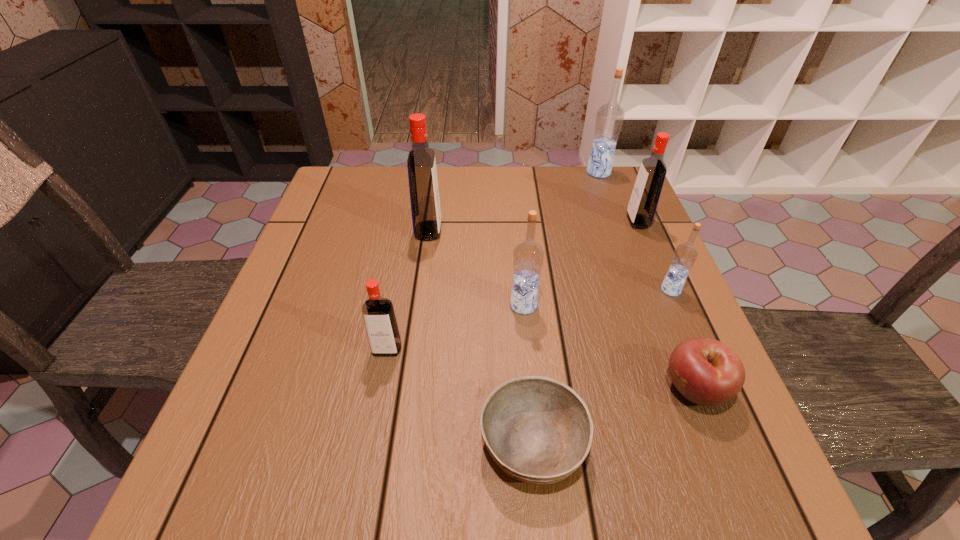
Identify the location of the farthest vodka. (609, 119).

I want to click on the farthest object, so click(x=609, y=119).

The height and width of the screenshot is (540, 960). What are the coordinates of `the biggest red vodka` in the screenshot? It's located at (423, 183).

The image size is (960, 540). I want to click on the rightmost red vodka, so click(642, 206).

I want to click on the second biggest blue vodka, so click(x=528, y=256).

At what (x,y) coordinates should I click in order to perform the action: click on the fourth vodka from right to left. Please return your answer as a coordinate pair (x, y). This screenshot has height=540, width=960. Looking at the image, I should click on (528, 256).

The width and height of the screenshot is (960, 540). I want to click on the nearest red vodka, so click(378, 313).

The image size is (960, 540). I want to click on the smallest red vodka, so click(x=378, y=313).

Locate an element on the screen. The width and height of the screenshot is (960, 540). the rightmost blue vodka is located at coordinates (685, 255).

The height and width of the screenshot is (540, 960). I want to click on the seventh tallest object, so click(705, 371).